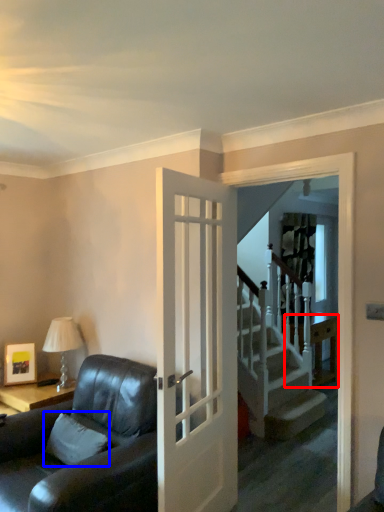
Question: Which object appears farthest to the camera in this image, table (highlighted by a red box) or pillow (highlighted by a blue box)?

Choices:
 (A) table
 (B) pillow

Answer: (A)